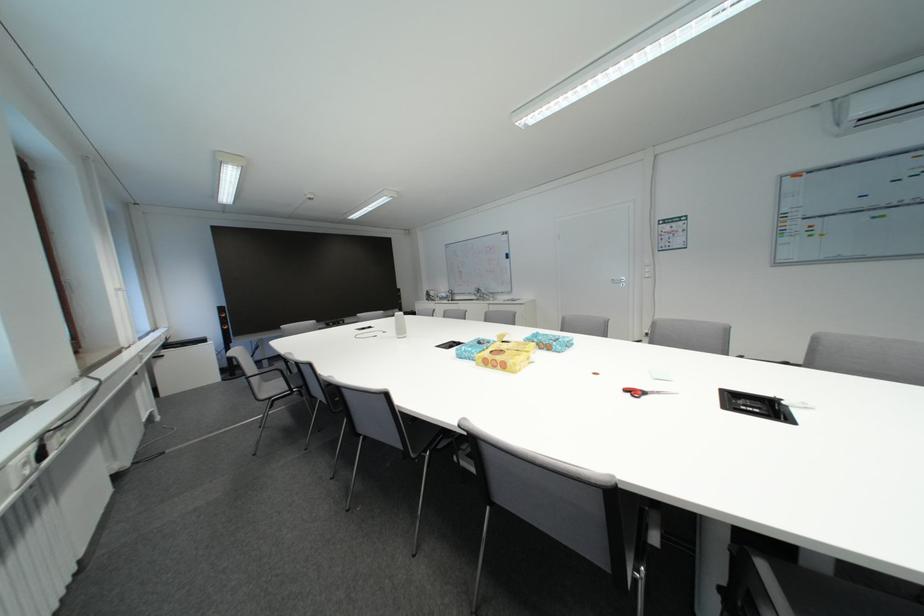
Identify the location of silver door handle. The height and width of the screenshot is (616, 924). (618, 281).